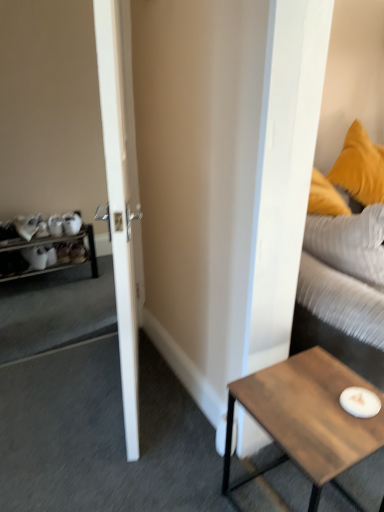
The image size is (384, 512). I want to click on free spot above wooden coffee table at lower right (from a real-world perspective), so click(314, 402).